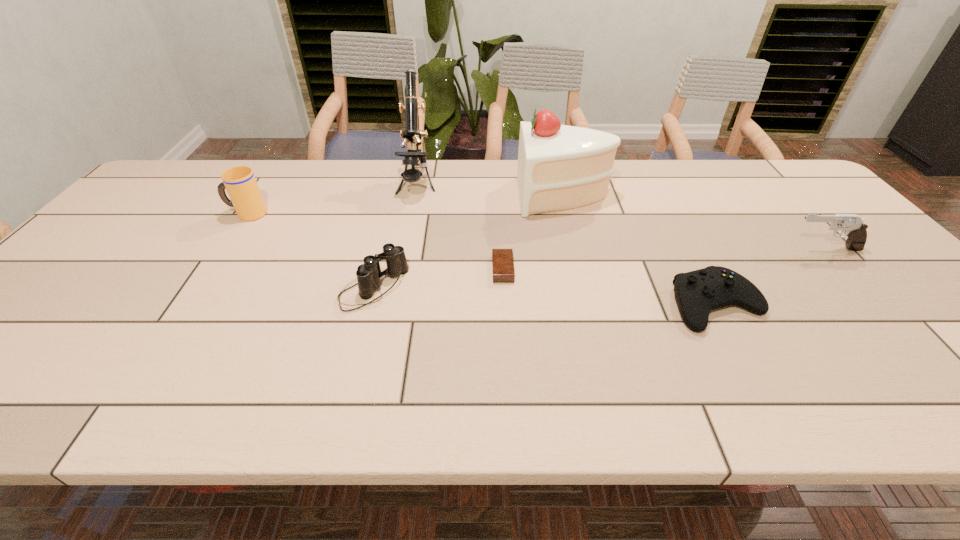
Locate an element on the screen. the tallest object is located at coordinates (412, 134).

Locate an element on the screen. the third object from right to left is located at coordinates (560, 167).

Image resolution: width=960 pixels, height=540 pixels. What are the coordinates of `the sixth shortest object` in the screenshot? It's located at (560, 167).

The height and width of the screenshot is (540, 960). I want to click on cup, so click(x=240, y=183).

Identify the location of the leftmost object. This screenshot has width=960, height=540. (240, 183).

Identify the location of gun. (855, 229).

The image size is (960, 540). Find the location of `the rightmost object`. the rightmost object is located at coordinates (855, 229).

Image resolution: width=960 pixels, height=540 pixels. In order to click on binoculars in this screenshot , I will do `click(368, 274)`.

This screenshot has height=540, width=960. I want to click on control, so click(x=698, y=292).

You are a GUI agent. You are given a task and a screenshot of the screen. Output one action in this format:
    pyautogui.click(x=<x>, y=<y>)
    Task: Click on the second object from right to left
    This screenshot has height=540, width=960.
    Given the screenshot: What is the action you would take?
    pyautogui.click(x=698, y=292)